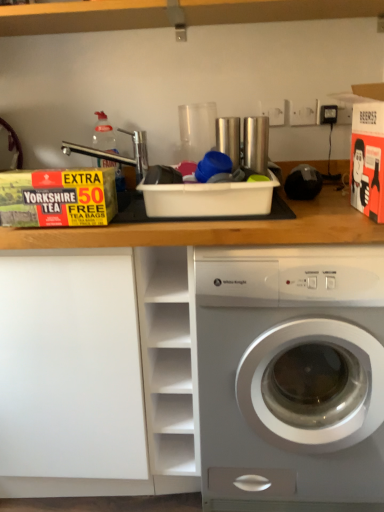
Question: Choose the correct answer: Is white matte box at left inside clear plastic bottle at upper left or outside it?

Choices:
 (A) outside
 (B) inside

Answer: (A)

Question: In terms of size, does white matte box at left appear bigger or smaller than clear plastic bottle at upper left?

Choices:
 (A) small
 (B) big

Answer: (B)

Question: Considering the real-world distances, which object is closest to the clear plastic bottle at upper left?

Choices:
 (A) white matte box at left
 (B) white matte cabinet at center
 (C) white glossy washing machine at center

Answer: (B)

Question: Based on their relative distances, which object is nearer to the clear plastic bottle at upper left?

Choices:
 (A) white matte cabinet at center
 (B) white glossy washing machine at center
 (C) white matte box at left

Answer: (A)